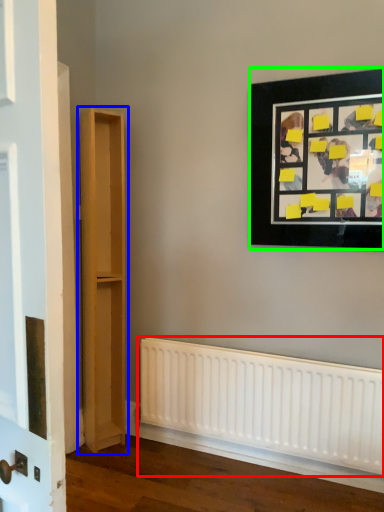
Question: Which object is the farthest from radiator (highlighted by a red box)? Choose among these: bookshelf (highlighted by a blue box) or picture frame (highlighted by a green box).

Choices:
 (A) bookshelf
 (B) picture frame

Answer: (B)